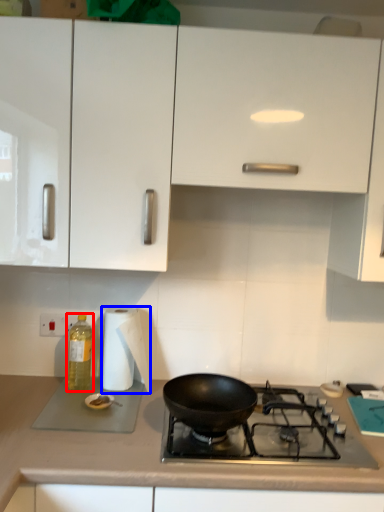
Question: Which point is further to the camera, bottle (highlighted by a red box) or paper towel (highlighted by a blue box)?

Choices:
 (A) bottle
 (B) paper towel

Answer: (A)